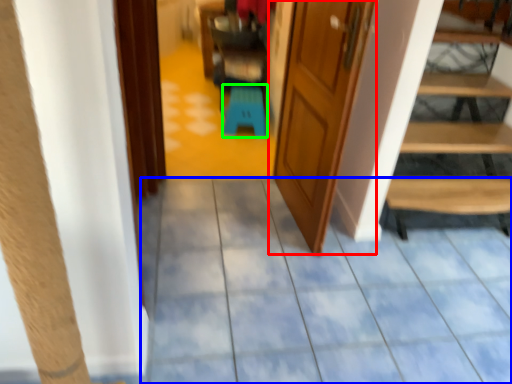
Question: Which object is positioned farthest from door (highlighted by a red box)? Select from path (highlighted by a blue box) and stool (highlighted by a green box).

Choices:
 (A) path
 (B) stool

Answer: (B)